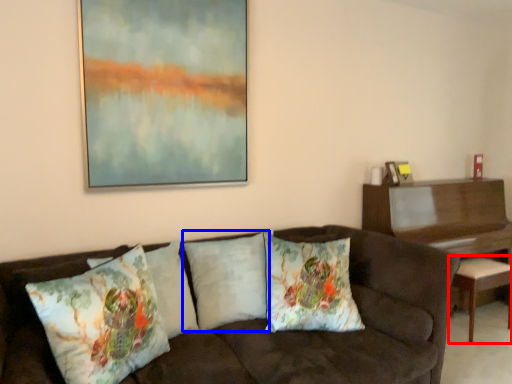
Question: Which of the following is the farthest to the observer, stool (highlighted by a red box) or pillow (highlighted by a blue box)?

Choices:
 (A) stool
 (B) pillow

Answer: (A)